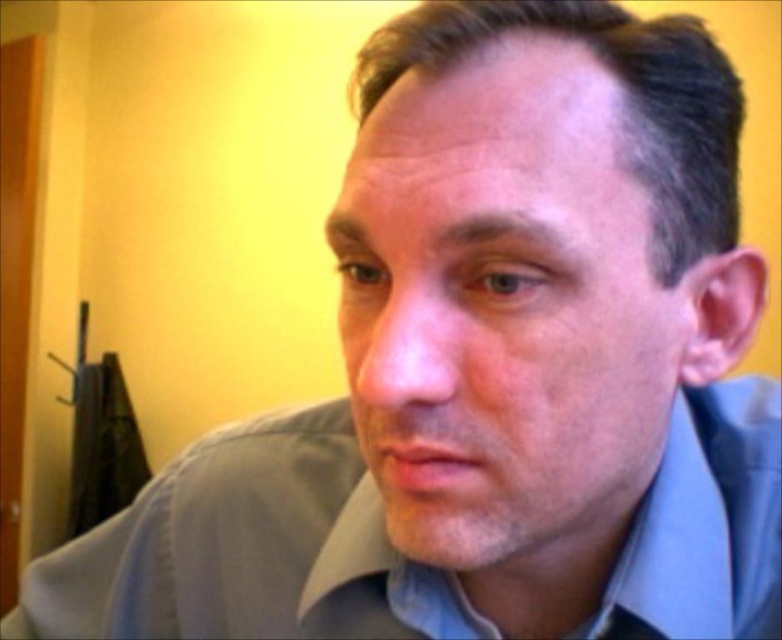
Based on the photo, you are a photographer adjusting your camera settings. You notice the smooth skin face at center and the light blue cotton dress shirt at center in your frame. Which object is positioned closer to your camera lens?

The smooth skin face at center is closer to the viewer than the light blue cotton dress shirt at center, so the smooth skin face at center would be closer to the camera lens.

You are a photographer adjusting the lighting for a portrait session. The subject has a smooth skin face at center. Where exactly should you position the main light to ensure even illumination across their face?

The smooth skin face at center is located at point (504, 310). Position the main light slightly to the left of this coordinate to achieve even illumination.

You are a photographer setting up a portrait shoot. You need to ensure that the subject, who has a smooth skin face at center and is wearing a light blue cotton dress shirt at center, is framed properly. Based on the scene description, which object should be placed higher in the frame to maintain proper proportions?

The smooth skin face at center should be placed higher in the frame since it is taller than the light blue cotton dress shirt at center.